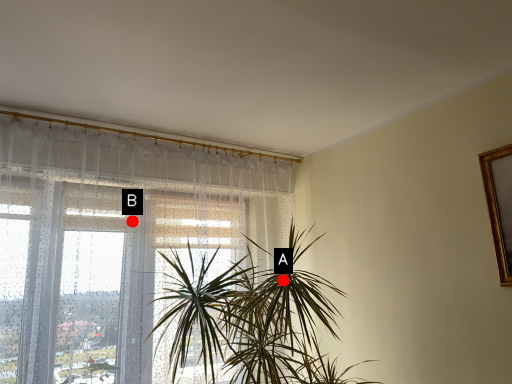
Question: Two points are circled on the image, labeled by A and B beside each circle. Which point appears closest to the camera in this image?

Choices:
 (A) A is closer
 (B) B is closer

Answer: (A)